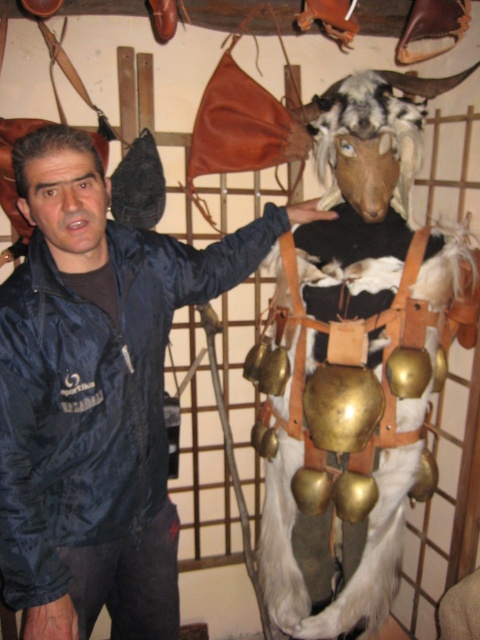
Can you confirm if matte black jacket at center is positioned below white fur animal at center?

Indeed, matte black jacket at center is positioned under white fur animal at center.

Looking at this image, can you confirm if matte black jacket at center is smaller than white fur animal at center?

No.

The height and width of the screenshot is (640, 480). What do you see at coordinates (96, 394) in the screenshot?
I see `matte black jacket at center` at bounding box center [96, 394].

Locate an element on the screen. The image size is (480, 640). matte black jacket at center is located at coordinates 96,394.